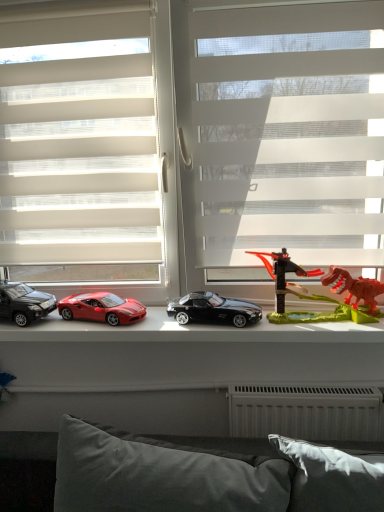
Question: Is the position of transparent plastic dinosaur at right less distant than that of shiny plastic toy cars at center?

Choices:
 (A) no
 (B) yes

Answer: (B)

Question: Is transparent plastic dinosaur at right not close to shiny plastic toy cars at center?

Choices:
 (A) no
 (B) yes

Answer: (A)

Question: Is shiny plastic toy cars at center a part of transparent plastic dinosaur at right?

Choices:
 (A) yes
 (B) no

Answer: (B)

Question: From a real-world perspective, is transparent plastic dinosaur at right on top of shiny plastic toy cars at center?

Choices:
 (A) yes
 (B) no

Answer: (A)

Question: Is transparent plastic dinosaur at right looking in the opposite direction of shiny plastic toy cars at center?

Choices:
 (A) yes
 (B) no

Answer: (B)

Question: Is transparent plastic dinosaur at right with shiny plastic toy cars at center?

Choices:
 (A) yes
 (B) no

Answer: (B)

Question: Is shiny plastic toy cars at center aimed at shiny black car at left, placed as the 3th car when sorted from right to left?

Choices:
 (A) yes
 (B) no

Answer: (B)

Question: Would you say shiny black car at left, placed as the 1th car when sorted from left to right, is part of shiny plastic toy cars at center's contents?

Choices:
 (A) yes
 (B) no

Answer: (B)

Question: Considering the relative sizes of shiny plastic toy cars at center and shiny black car at left, placed as the 3th car when sorted from right to left, in the image provided, is shiny plastic toy cars at center shorter than shiny black car at left, placed as the 3th car when sorted from right to left,?

Choices:
 (A) yes
 (B) no

Answer: (A)

Question: Is shiny plastic toy cars at center further to camera compared to shiny black car at left, placed as the 3th car when sorted from right to left?

Choices:
 (A) yes
 (B) no

Answer: (B)

Question: Is shiny plastic toy cars at center outside shiny black car at left, placed as the 1th car when sorted from left to right?

Choices:
 (A) no
 (B) yes

Answer: (B)

Question: Is the depth of shiny plastic toy cars at center less than that of shiny black car at left, placed as the 3th car when sorted from right to left?

Choices:
 (A) yes
 (B) no

Answer: (A)

Question: Is shiny black car at left, placed as the 3th car when sorted from right to left, positioned far away from white sheer blinds at center, which appears as the 1th window when viewed from the left?

Choices:
 (A) no
 (B) yes

Answer: (A)